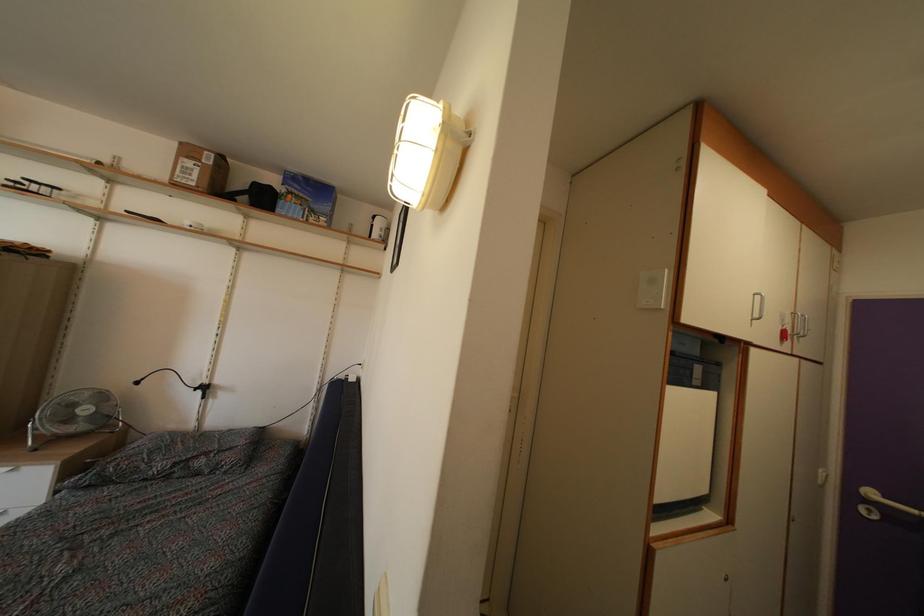
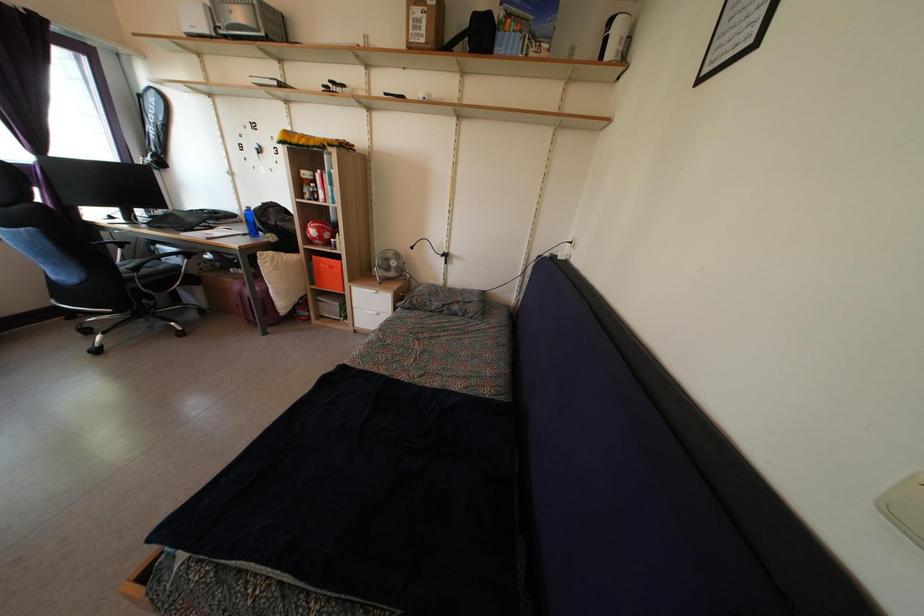
Based on the continuous images, in which direction is the camera rotating?

The camera's rotation is toward left-down.